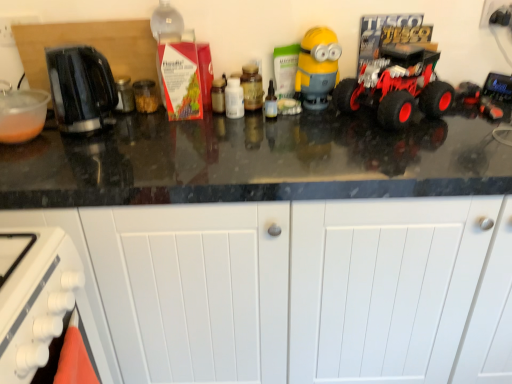
The height and width of the screenshot is (384, 512). What are the coordinates of `free space to the right of transparent glass bottle at center, acting as the 3th bottle starting from the left` in the screenshot? It's located at (333, 121).